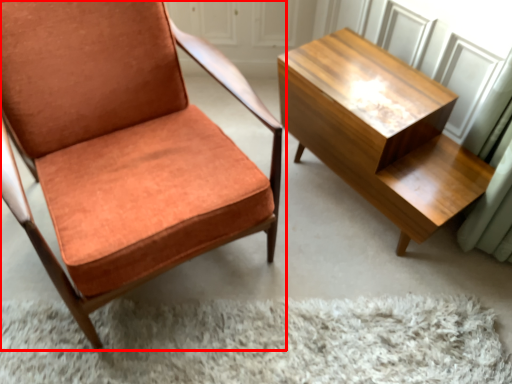
Question: From the image's perspective, where is chair (annotated by the red box) located relative to table?

Choices:
 (A) below
 (B) above

Answer: (B)